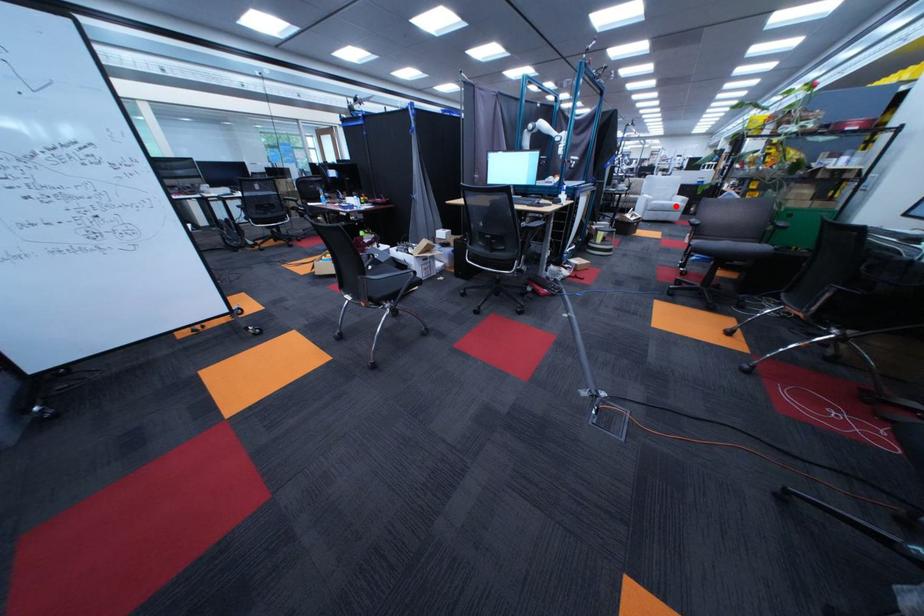
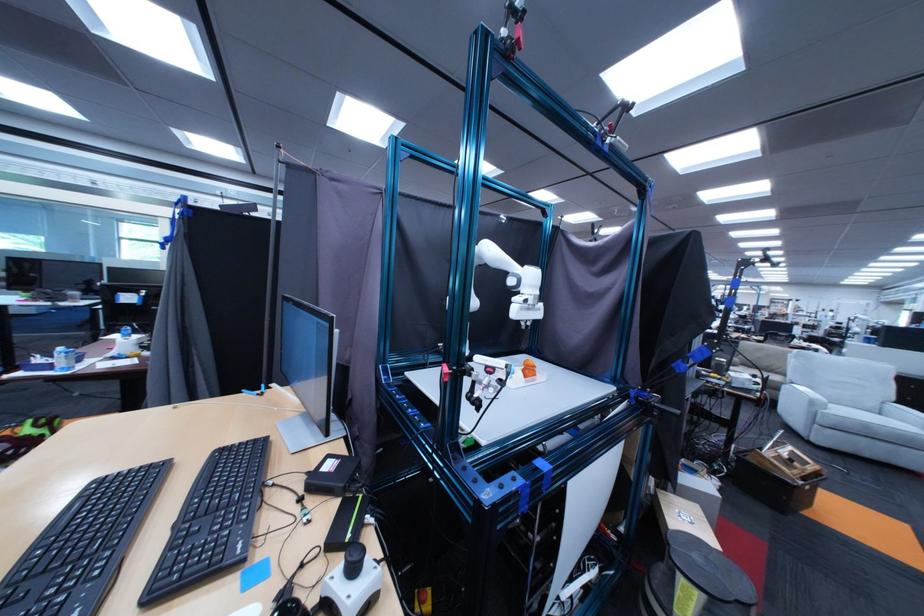
Question: I am providing you with two images of the same scene from different viewpoints. In image1, a red point is highlighted. Considering the same 3D point in image2, which of the following is correct?

Choices:
 (A) It is closer
 (B) It is farther

Answer: (B)